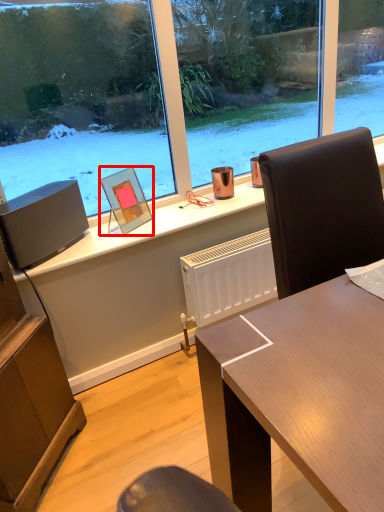
Question: From the image, what is the correct spatial relationship of picture frame (annotated by the red box) in relation to loudspeaker?

Choices:
 (A) right
 (B) left

Answer: (A)